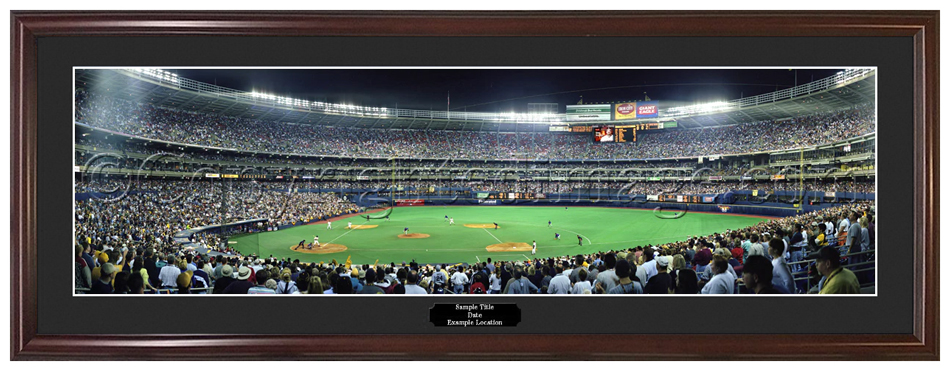
Locate an element on the screen. The height and width of the screenshot is (371, 950). dark gray matting is located at coordinates (49, 133).